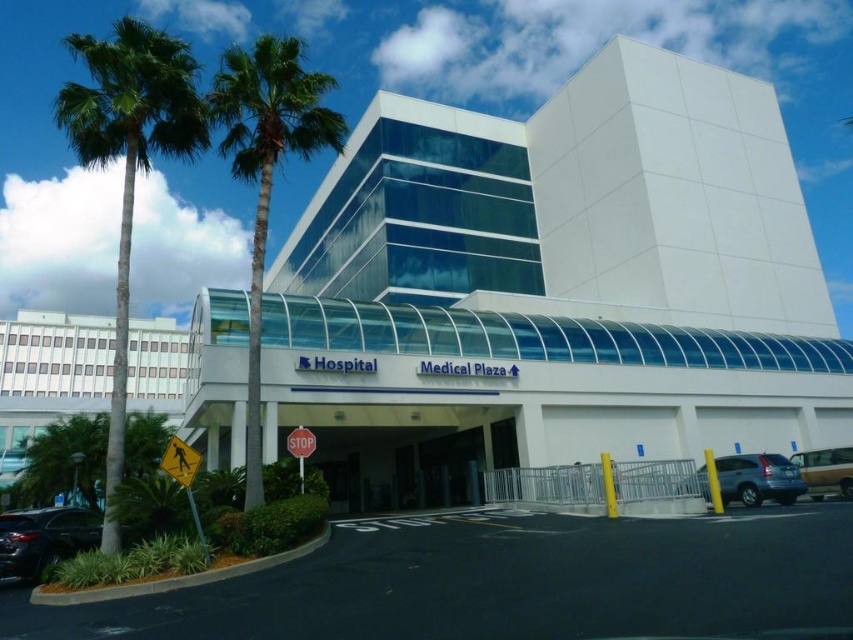
Which is more to the left, green leafy palm tree at left or green leafy palm tree at center?

green leafy palm tree at left is more to the left.

Between green leafy palm tree at left and green leafy palm tree at center, which one is positioned lower?

green leafy palm tree at left is lower down.

The image size is (853, 640). I want to click on green leafy palm tree at left, so click(129, 163).

In order to click on green leafy palm tree at left in this screenshot , I will do `click(129, 163)`.

Is shiny black sedan at lower left positioned behind metallic silver van at lower right?

No, it is in front of metallic silver van at lower right.

Find the location of a particular element. shiny black sedan at lower left is located at coordinates (44, 538).

Does point (74, 515) lie in front of point (833, 474)?

That is True.

Identify the location of shiny black sedan at lower left. The width and height of the screenshot is (853, 640). (44, 538).

Who is lower down, white matte building at left or green leafy palm tree at center?

white matte building at left is lower down.

Does white matte building at left have a lesser height compared to green leafy palm tree at center?

Indeed, white matte building at left has a lesser height compared to green leafy palm tree at center.

Find the location of a particular element. This screenshot has width=853, height=640. white matte building at left is located at coordinates (49, 376).